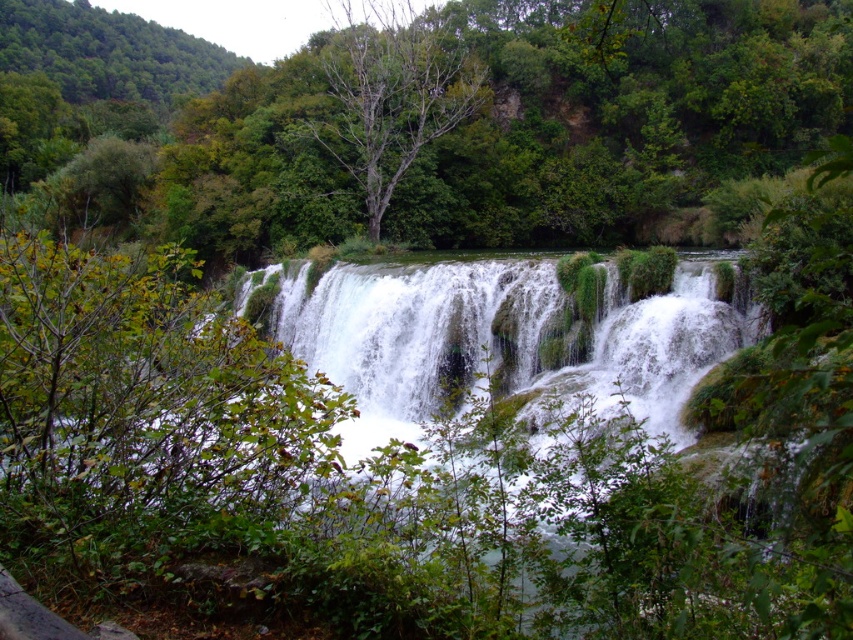
You are standing in front of the waterfall and want to place a small decorative rock at each of the two points marked in the scene. Which point, point (558, 234) or point (386, 51), is closer to you so you can reach it without moving your position?

Point (558, 234) is closer to you, so you can reach it without moving your position because it is further to the viewer than point (386, 51).

You are standing in front of the waterfall and want to place a small decorative rock at each of the two points marked in the image. Which point, point 1 at coordinates (x=670, y=403) or point 2 at coordinates (x=431, y=35), is closer to you so that you can reach it without moving further away from the waterfall?

Point 1 at coordinates (x=670, y=403) is closer to the viewer than point 2 at coordinates (x=431, y=35), so you can reach it without moving further away from the waterfall.